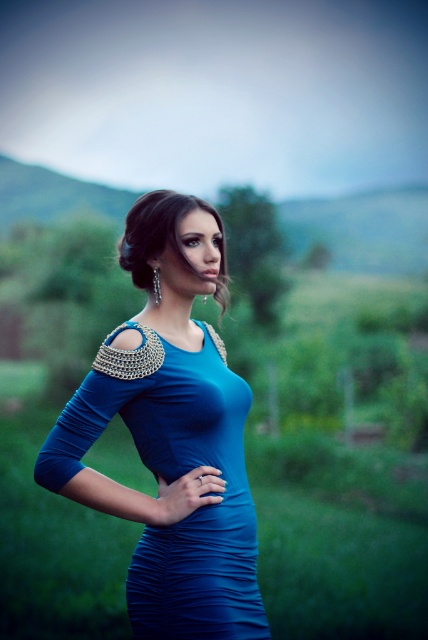
You are a fashion designer observing the woman in the image wearing two dresses, the ruched satin dress at center and the satin blue dress at center. Which dress appears to be smaller in size?

The ruched satin dress at center has a smaller size compared to the satin blue dress at center, so the ruched satin dress at center appears to be smaller in size.

Consider the image. You are a fashion designer observing the woman in the scene. You need to decide whether both the matte blue dress at center and the satin blue dress at center can be displayed side by side on a single mannequin without overlapping. The mannequin has a display area that is 16 inches wide. Can both dresses fit?

The matte blue dress at center and satin blue dress at center are 14.38 inches apart from each other. Since the display area is 16 inches wide, both dresses can fit side by side on the mannequin without overlapping.